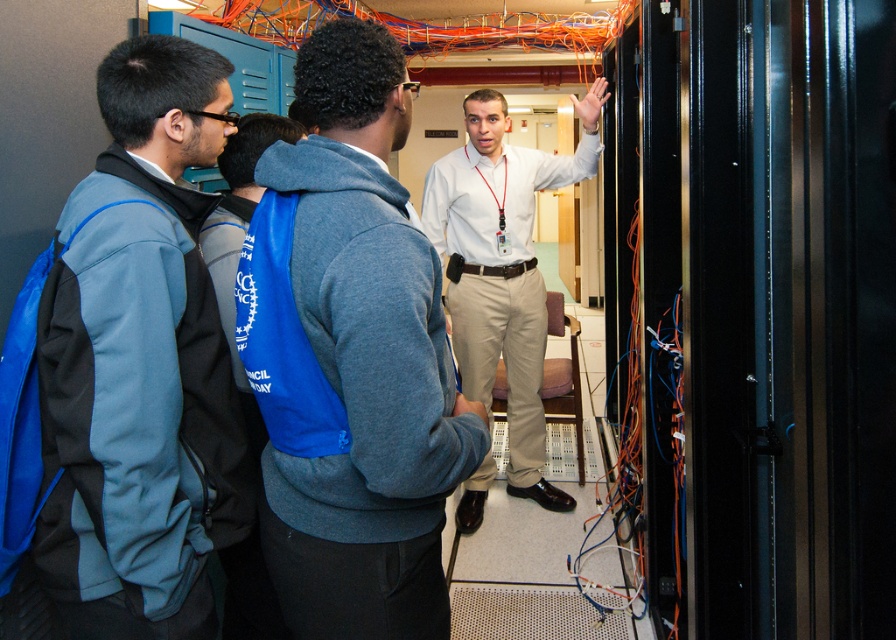
You are standing in the server room and want to take a photo of the point at coordinates (158, 220). Is the point within your camera range if your camera can focus on objects up to 1.5 meters away?

The point at coordinates (158, 220) is 1.38 meters away from the camera, which is within the camera range of 1.5 meters. Therefore, the point can be focused on.

You are part of a group observing a presentation in a server room. There is a person wearing a blue fleece jacket at left and another in a white shirt at center. Which individual is positioned closer to the front of the group?

The blue fleece jacket at left is closer to the viewer than the white shirt at center, so the person in the blue fleece jacket at left is positioned closer to the front of the group.

You are trying to decide which person to approach for help in the server room. Both the gray hoodie at center and the white shirt at center are facing forward. Which one has a narrower torso?

The gray hoodie at center is thinner than the white shirt at center, so the gray hoodie at center has a narrower torso.